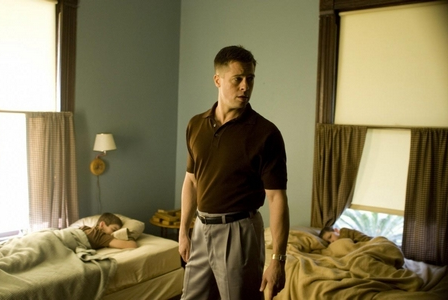
I want to click on table, so click(169, 225).